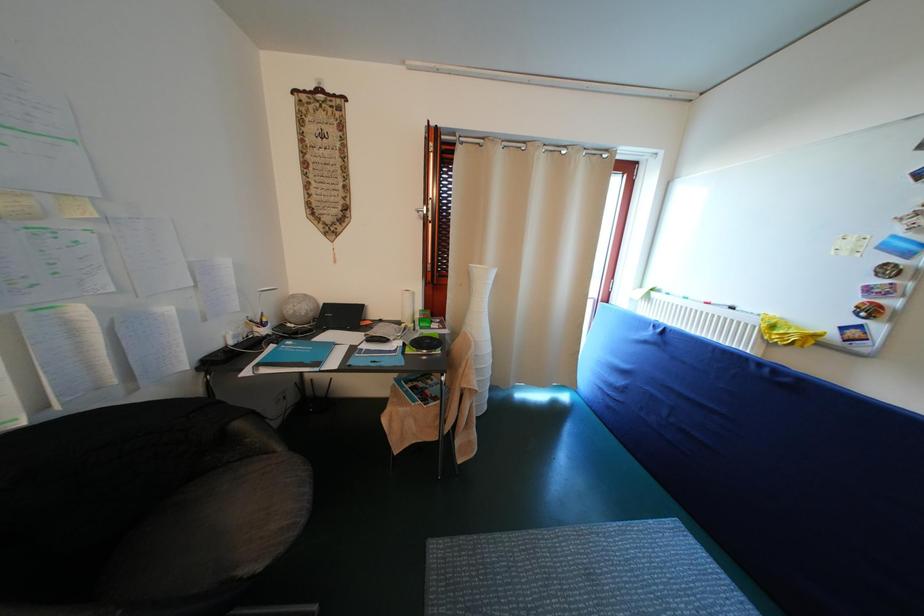
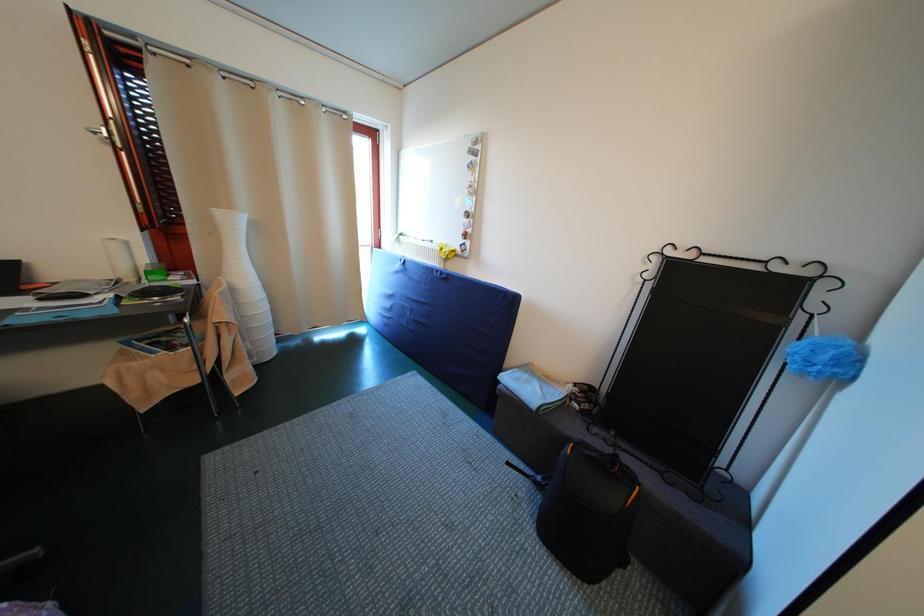
Question: The camera is either moving clockwise (left) or counter-clockwise (right) around the object. The first image is from the beginning of the video and the second image is from the end. Is the camera moving left or right when shooting the video?

Choices:
 (A) Left
 (B) Right

Answer: (A)